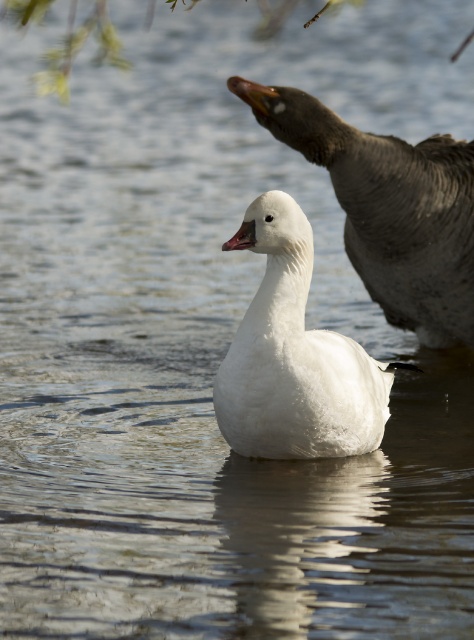
You are a wildlife photographer aiming to capture both the dark gray matte goose at upper right and the white matte goose at center in a single frame. Given their sizes, which goose would appear closer to the camera in the photo?

The dark gray matte goose at upper right is larger in size than the white matte goose at center, so it would appear closer to the camera in the photo.

Looking at this image, you are a wildlife photographer aiming to capture both the dark gray matte goose at upper right and the matte pink beak at center in a single photo. Given that your camera has a focal length of 100mm, which allows you to focus on objects up to 4 feet away, can you include both subjects in your shot without moving your position?

The dark gray matte goose at upper right and the matte pink beak at center are 3.56 feet apart from each other. Since the maximum distance your camera can focus is 4 feet, you can include both subjects in your shot as the distance between them is within the camera range.

You are a wildlife photographer aiming to capture both the dark gray matte goose at upper right and the matte pink beak at center in a single frame. Based on their positions, which goose is positioned closer to the edge of the water?

The dark gray matte goose at upper right is positioned closer to the edge of the water than the matte pink beak at center.